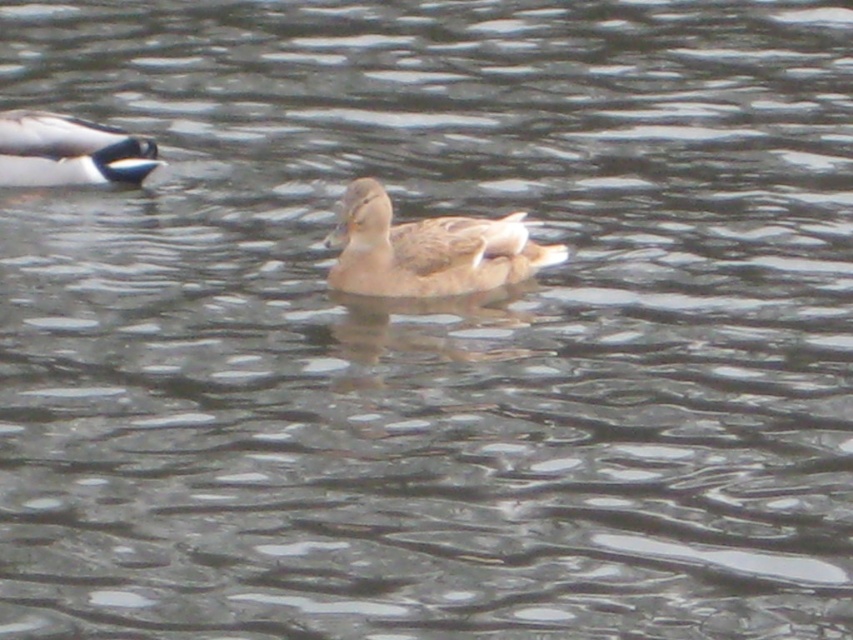
Is brown matte duck at center closer to the viewer compared to white glossy duck at upper left?

Yes, brown matte duck at center is in front of white glossy duck at upper left.

Measure the distance between point (341, 276) and camera.

Point (341, 276) is 5.63 meters from camera.

Which is in front, point (383, 228) or point (83, 154)?

Point (383, 228)

Locate an element on the screen. This screenshot has width=853, height=640. brown matte duck at center is located at coordinates (427, 250).